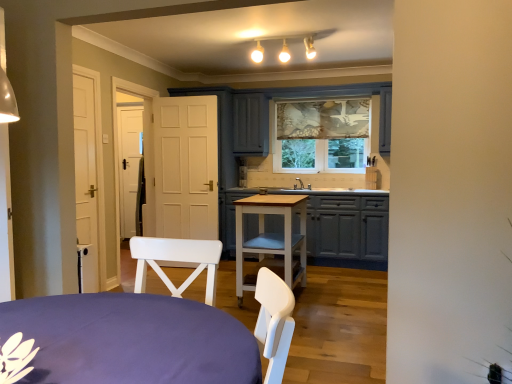
Question: Is light brown wooden table at center, arranged as the 2th table when viewed from the front, aimed at purple fabric-covered table at lower left, which is the 2th table from back to front?

Choices:
 (A) yes
 (B) no

Answer: (B)

Question: Considering the relative sizes of light brown wooden table at center, the first table positioned from the back, and purple fabric-covered table at lower left, which is the 2th table from back to front, in the image provided, is light brown wooden table at center, the first table positioned from the back, shorter than purple fabric-covered table at lower left, which is the 2th table from back to front,?

Choices:
 (A) yes
 (B) no

Answer: (B)

Question: Does light brown wooden table at center, the first table positioned from the back, have a smaller size compared to purple fabric-covered table at lower left, marked as the 1th table in a front-to-back arrangement?

Choices:
 (A) yes
 (B) no

Answer: (B)

Question: From the image's perspective, is light brown wooden table at center, the first table positioned from the back, under purple fabric-covered table at lower left, which is the 2th table from back to front?

Choices:
 (A) no
 (B) yes

Answer: (A)

Question: Does light brown wooden table at center, the first table positioned from the back, appear on the right side of purple fabric-covered table at lower left, marked as the 1th table in a front-to-back arrangement?

Choices:
 (A) yes
 (B) no

Answer: (A)

Question: From the image's perspective, relative to matte gray cabinets at center, is light brown wooden table at center, arranged as the 2th table when viewed from the front, above or below?

Choices:
 (A) above
 (B) below

Answer: (B)

Question: Is light brown wooden table at center, the first table positioned from the back, situated inside matte gray cabinets at center or outside?

Choices:
 (A) inside
 (B) outside

Answer: (B)

Question: Would you say light brown wooden table at center, the first table positioned from the back, is to the left or to the right of matte gray cabinets at center in the picture?

Choices:
 (A) left
 (B) right

Answer: (A)

Question: In terms of height, does light brown wooden table at center, the first table positioned from the back, look taller or shorter compared to matte gray cabinets at center?

Choices:
 (A) short
 (B) tall

Answer: (A)

Question: Is point (58, 306) closer or farther from the camera than point (337, 235)?

Choices:
 (A) farther
 (B) closer

Answer: (B)

Question: Would you say purple fabric-covered table at lower left, which is the 2th table from back to front, is to the left or to the right of matte gray cabinets at center in the picture?

Choices:
 (A) right
 (B) left

Answer: (B)

Question: Which is correct: purple fabric-covered table at lower left, which is the 2th table from back to front, is inside matte gray cabinets at center, or outside of it?

Choices:
 (A) inside
 (B) outside

Answer: (B)

Question: From the image's perspective, is purple fabric-covered table at lower left, marked as the 1th table in a front-to-back arrangement, above or below matte gray cabinets at center?

Choices:
 (A) below
 (B) above

Answer: (A)

Question: Considering the relative positions of light brown wooden table at center, the first table positioned from the back, and purple fabric-covered table at lower left, which is the 2th table from back to front, in the image provided, is light brown wooden table at center, the first table positioned from the back, to the left or to the right of purple fabric-covered table at lower left, which is the 2th table from back to front,?

Choices:
 (A) left
 (B) right

Answer: (B)

Question: Is light brown wooden table at center, the first table positioned from the back, situated inside purple fabric-covered table at lower left, marked as the 1th table in a front-to-back arrangement, or outside?

Choices:
 (A) outside
 (B) inside

Answer: (A)